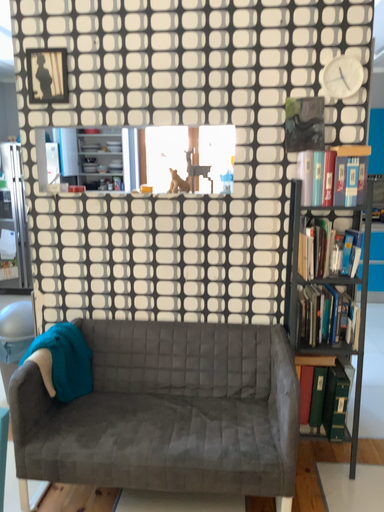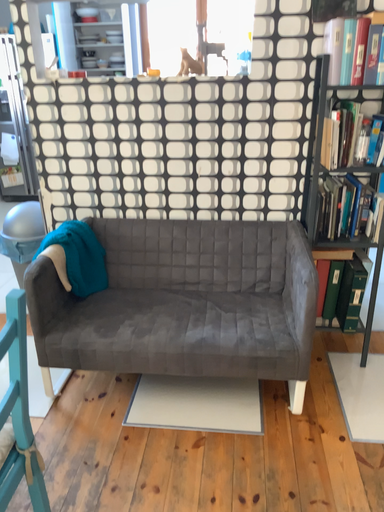
Question: How did the camera likely rotate when shooting the video?

Choices:
 (A) rotated downward
 (B) rotated upward

Answer: (A)